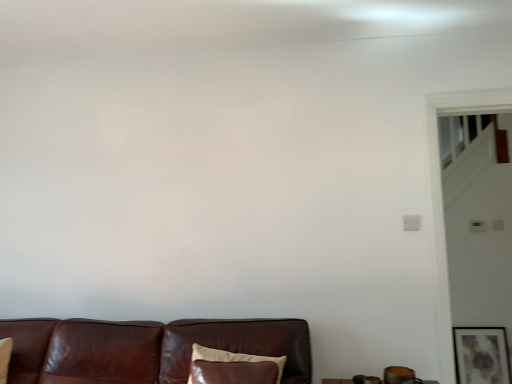
Question: From the image's perspective, is matte gray painting at lower right on brown leather couch at lower center?

Choices:
 (A) no
 (B) yes

Answer: (A)

Question: Can you confirm if matte gray painting at lower right is wider than brown leather couch at lower center?

Choices:
 (A) no
 (B) yes

Answer: (A)

Question: Is matte gray painting at lower right with brown leather couch at lower center?

Choices:
 (A) no
 (B) yes

Answer: (A)

Question: Is matte gray painting at lower right not within brown leather couch at lower center?

Choices:
 (A) no
 (B) yes

Answer: (B)

Question: Considering the relative sizes of matte gray painting at lower right and brown leather couch at lower center in the image provided, is matte gray painting at lower right smaller than brown leather couch at lower center?

Choices:
 (A) no
 (B) yes

Answer: (B)

Question: From a real-world perspective, does matte gray painting at lower right stand above brown leather couch at lower center?

Choices:
 (A) yes
 (B) no

Answer: (B)

Question: From the image's perspective, would you say brown leather pillow at lower center is positioned over brown leather couch at lower center?

Choices:
 (A) no
 (B) yes

Answer: (B)

Question: Could you tell me if brown leather pillow at lower center is turned towards brown leather couch at lower center?

Choices:
 (A) yes
 (B) no

Answer: (A)

Question: Would you consider brown leather pillow at lower center to be distant from brown leather couch at lower center?

Choices:
 (A) no
 (B) yes

Answer: (A)

Question: Considering the relative sizes of brown leather pillow at lower center and brown leather couch at lower center in the image provided, is brown leather pillow at lower center wider than brown leather couch at lower center?

Choices:
 (A) no
 (B) yes

Answer: (A)

Question: Is brown leather pillow at lower center positioned behind brown leather couch at lower center?

Choices:
 (A) yes
 (B) no

Answer: (A)

Question: Is brown leather pillow at lower center outside of brown leather couch at lower center?

Choices:
 (A) yes
 (B) no

Answer: (B)

Question: Would you say matte gray painting at lower right is part of brown leather couch at lower center's contents?

Choices:
 (A) yes
 (B) no

Answer: (B)